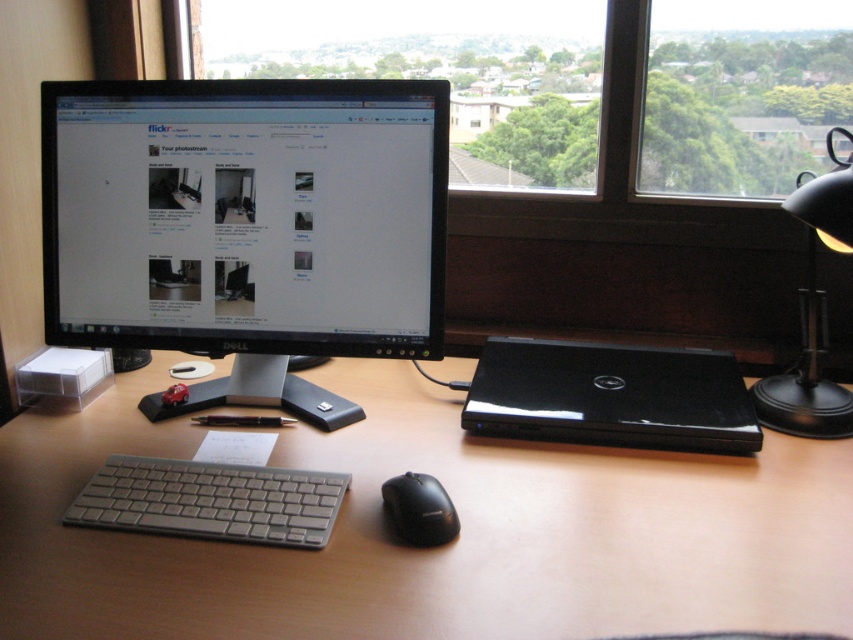
Is point (727, 116) positioned before point (410, 544)?

No.

Is point (727, 51) in front of point (428, 484)?

No.

The height and width of the screenshot is (640, 853). What are the coordinates of `transparent glass window at upper right` in the screenshot? It's located at (741, 93).

Can you confirm if black metal desk lamp at right is taller than black matte mouse at center?

Correct, black metal desk lamp at right is much taller as black matte mouse at center.

Is black metal desk lamp at right to the left of black matte mouse at center from the viewer's perspective?

In fact, black metal desk lamp at right is to the right of black matte mouse at center.

Does point (804, 196) lie in front of point (395, 476)?

No, (804, 196) is behind (395, 476).

The width and height of the screenshot is (853, 640). I want to click on black metal desk lamp at right, so click(x=813, y=310).

Is black glossy monitor at upper left above black matte mouse at center?

Indeed, black glossy monitor at upper left is positioned over black matte mouse at center.

Where is `black glossy monitor at upper left`? Image resolution: width=853 pixels, height=640 pixels. black glossy monitor at upper left is located at coordinates (245, 216).